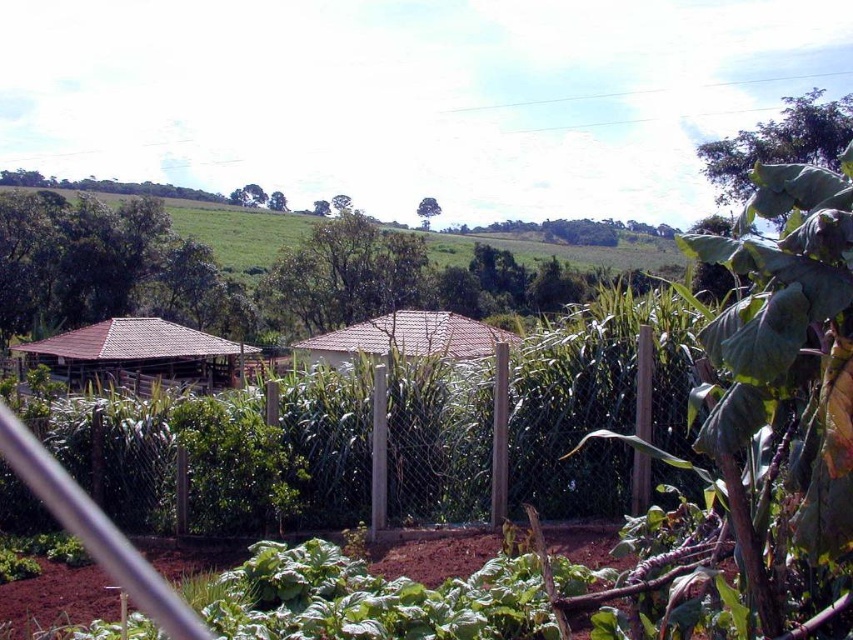
Question: Among these points, which one is farthest from the camera?

Choices:
 (A) (433, 355)
 (B) (370, 396)
 (C) (119, 358)

Answer: (C)

Question: Is brown wooden hut at left above brown tile hut at center?

Choices:
 (A) no
 (B) yes

Answer: (A)

Question: Considering the relative positions of wooden fence at center and brown tile hut at center in the image provided, where is wooden fence at center located with respect to brown tile hut at center?

Choices:
 (A) below
 (B) above

Answer: (A)

Question: Which object appears farthest from the camera in this image?

Choices:
 (A) brown wooden hut at left
 (B) brown tile hut at center

Answer: (A)

Question: Does wooden fence at center appear on the left side of brown wooden hut at left?

Choices:
 (A) no
 (B) yes

Answer: (A)

Question: Which object is the closest to the brown tile hut at center?

Choices:
 (A) wooden fence at center
 (B) brown wooden hut at left

Answer: (B)